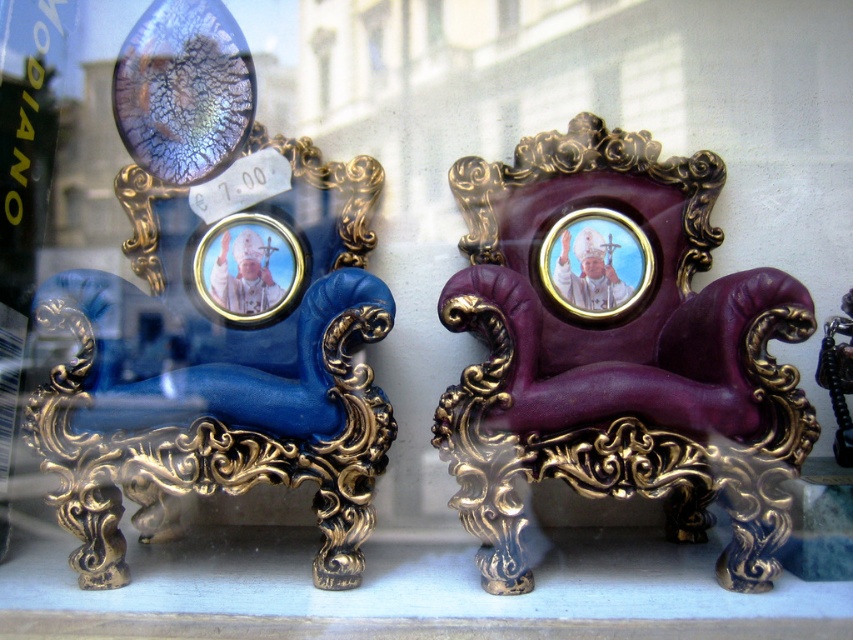
You are a customer in a shop looking at the purple leather armchair at center and the gold metallic picture frame at center. Which object would you need to lean forward more to get a closer look at?

The purple leather armchair at center is closer to the viewer than the gold metallic picture frame at center, so you would need to lean forward more to get a closer look at the gold metallic picture frame at center.